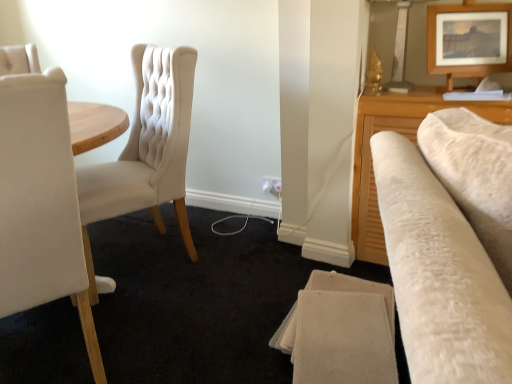
The height and width of the screenshot is (384, 512). Find the location of `space that is in front of matte cream fabric chair at left, the 1th chair from the back`. space that is in front of matte cream fabric chair at left, the 1th chair from the back is located at coordinates (x=158, y=320).